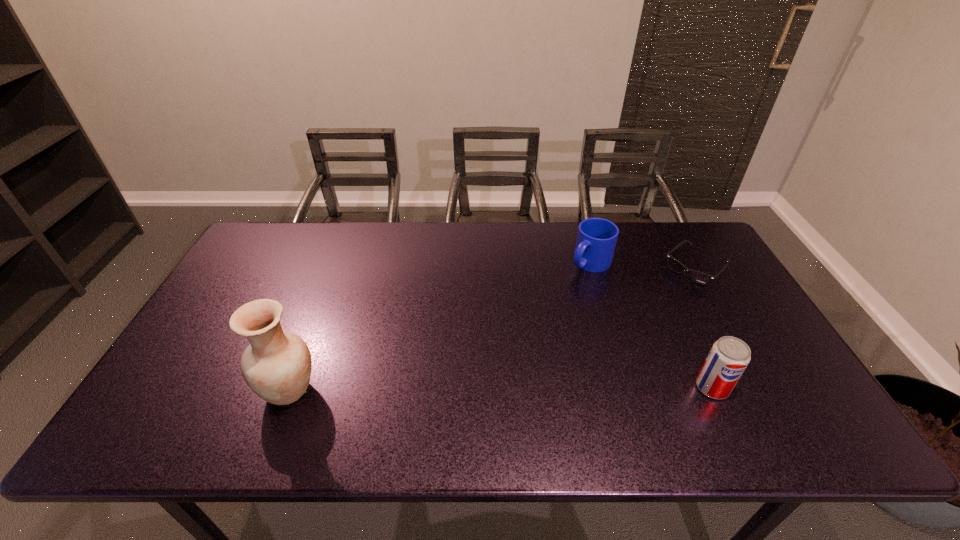
Where is `free space on the desktop that is between the pottery and the soda and is positioned on the side with the handle of the third object from right to left`? This screenshot has height=540, width=960. free space on the desktop that is between the pottery and the soda and is positioned on the side with the handle of the third object from right to left is located at coordinates pyautogui.click(x=444, y=389).

The width and height of the screenshot is (960, 540). What are the coordinates of `vacant spot on the desktop that is between the leftmost object and the soda and is positioned on the front-facing side of the shortest object` in the screenshot? It's located at (563, 388).